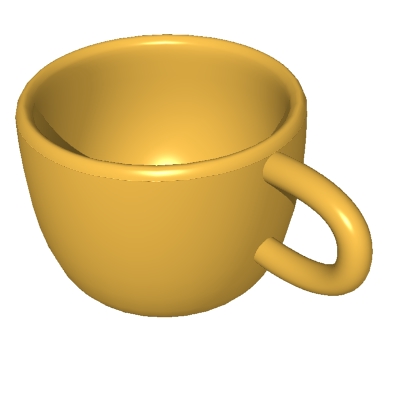
Where is `tea cup`? The image size is (400, 400). tea cup is located at coordinates (137, 211).